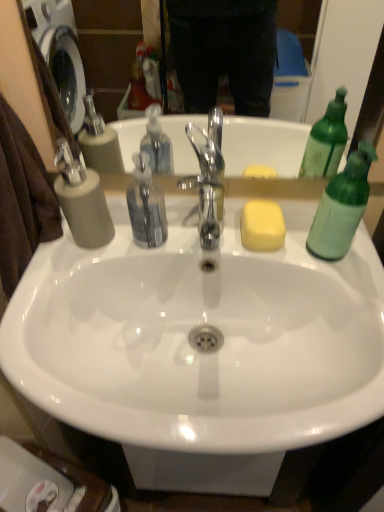
Question: From a real-world perspective, is green translucent bottle at right on white glossy sink at center?

Choices:
 (A) no
 (B) yes

Answer: (B)

Question: Does green translucent bottle at right appear on the left side of white glossy sink at center?

Choices:
 (A) yes
 (B) no

Answer: (B)

Question: Is green translucent bottle at right located outside white glossy sink at center?

Choices:
 (A) yes
 (B) no

Answer: (A)

Question: Is green translucent bottle at right wider than white glossy sink at center?

Choices:
 (A) no
 (B) yes

Answer: (A)

Question: From the image's perspective, is green translucent bottle at right under white glossy sink at center?

Choices:
 (A) no
 (B) yes

Answer: (A)

Question: Considering the positions of yellow matte soap at center and matte gray soap dispenser at left in the image, is yellow matte soap at center wider or thinner than matte gray soap dispenser at left?

Choices:
 (A) wide
 (B) thin

Answer: (A)

Question: Is point (274, 226) positioned closer to the camera than point (69, 175)?

Choices:
 (A) closer
 (B) farther

Answer: (B)

Question: In terms of height, does yellow matte soap at center look taller or shorter compared to matte gray soap dispenser at left?

Choices:
 (A) short
 (B) tall

Answer: (A)

Question: Relative to matte gray soap dispenser at left, is yellow matte soap at center in front or behind?

Choices:
 (A) behind
 (B) front

Answer: (A)

Question: Is matte gray soap dispenser at left wider or thinner than yellow matte soap at center?

Choices:
 (A) wide
 (B) thin

Answer: (B)

Question: In the image, is matte gray soap dispenser at left positioned in front of or behind yellow matte soap at center?

Choices:
 (A) behind
 (B) front

Answer: (B)

Question: From their relative heights in the image, would you say matte gray soap dispenser at left is taller or shorter than yellow matte soap at center?

Choices:
 (A) short
 (B) tall

Answer: (B)

Question: From the image's perspective, relative to yellow matte soap at center, is matte gray soap dispenser at left above or below?

Choices:
 (A) above
 (B) below

Answer: (A)

Question: Considering the positions of green translucent bottle at right and yellow matte soap at center in the image, is green translucent bottle at right wider or thinner than yellow matte soap at center?

Choices:
 (A) wide
 (B) thin

Answer: (B)

Question: From a real-world perspective, is green translucent bottle at right physically located above or below yellow matte soap at center?

Choices:
 (A) below
 (B) above

Answer: (B)